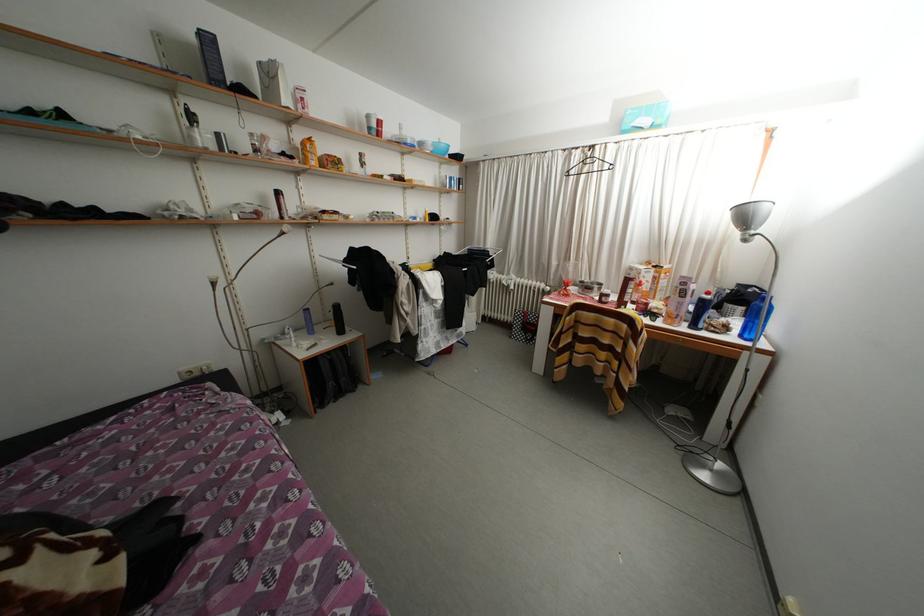
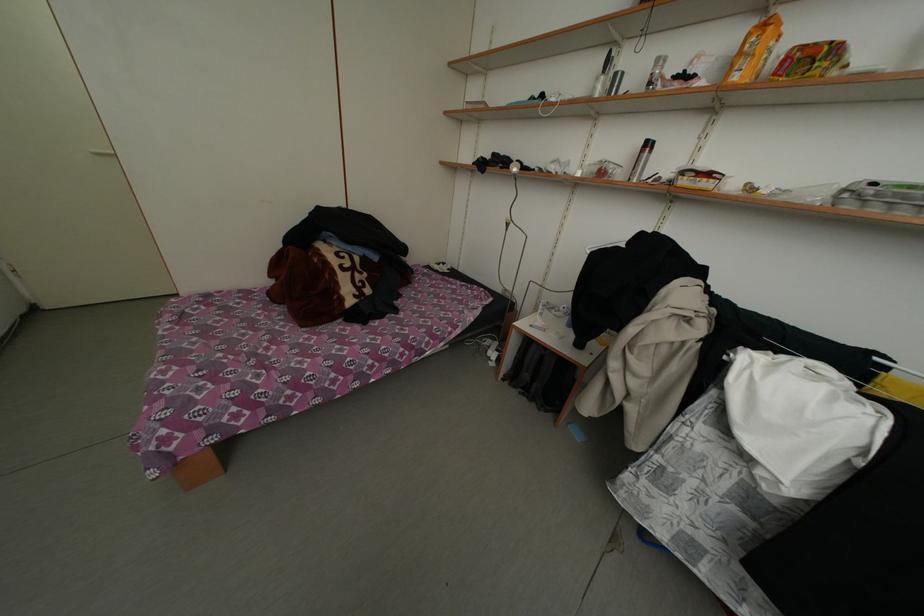
Where in the second image is the point corresponding to (318,145) from the first image?

(774, 29)